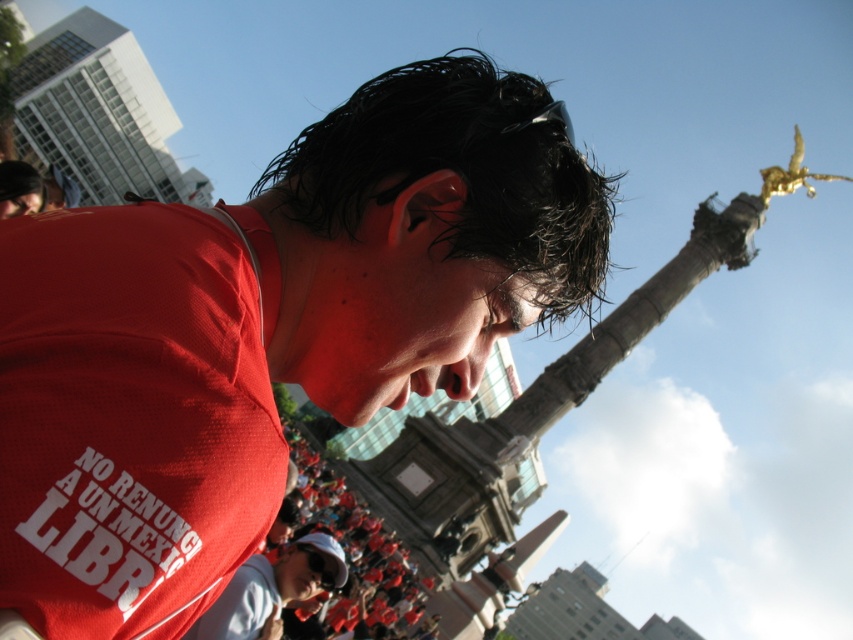
Does matte red jersey at center appear over matte white cap at lower center?

Yes.

Between matte red jersey at center and matte white cap at lower center, which one appears on the right side from the viewer's perspective?

→ Positioned to the right is matte red jersey at center.

Is point (4, 410) positioned behind point (270, 588)?

No, it is not.

The image size is (853, 640). Identify the location of matte red jersey at center. (267, 332).